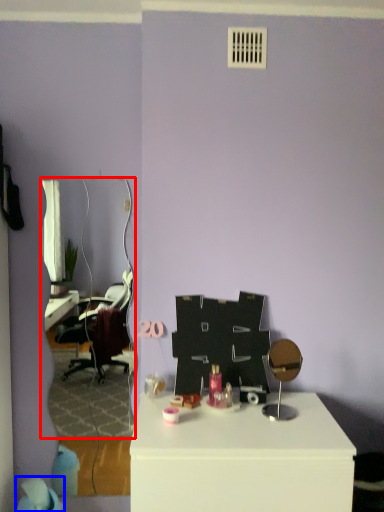
Question: Which point is further to the camera, mirror (highlighted by a red box) or bean bag chair (highlighted by a blue box)?

Choices:
 (A) mirror
 (B) bean bag chair

Answer: (A)